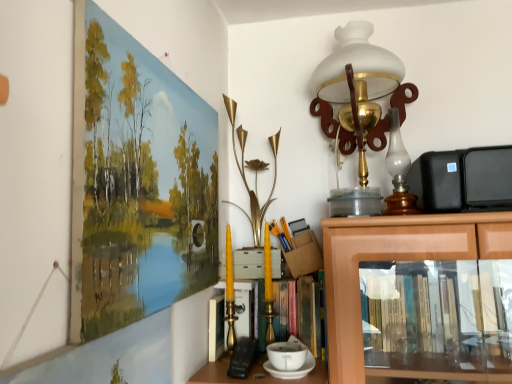
Question: Can you confirm if wooden picture frame at upper left is smaller than white frosted glass table lamp at upper right?

Choices:
 (A) no
 (B) yes

Answer: (B)

Question: Can white frosted glass table lamp at upper right be found inside wooden picture frame at upper left?

Choices:
 (A) yes
 (B) no

Answer: (B)

Question: Can you confirm if wooden picture frame at upper left is thinner than white frosted glass table lamp at upper right?

Choices:
 (A) no
 (B) yes

Answer: (B)

Question: From a real-world perspective, is wooden picture frame at upper left positioned under white frosted glass table lamp at upper right based on gravity?

Choices:
 (A) yes
 (B) no

Answer: (A)

Question: Is wooden picture frame at upper left positioned with its back to white frosted glass table lamp at upper right?

Choices:
 (A) yes
 (B) no

Answer: (B)

Question: From the image's perspective, is wooden picture frame at upper left under white frosted glass table lamp at upper right?

Choices:
 (A) no
 (B) yes

Answer: (B)

Question: Does white frosted glass table lamp at upper right have a larger size compared to wooden picture frame at upper left?

Choices:
 (A) yes
 (B) no

Answer: (A)

Question: Can you confirm if white frosted glass table lamp at upper right is shorter than wooden picture frame at upper left?

Choices:
 (A) no
 (B) yes

Answer: (A)

Question: From the image's perspective, is white frosted glass table lamp at upper right located beneath wooden picture frame at upper left?

Choices:
 (A) no
 (B) yes

Answer: (A)

Question: Is white frosted glass table lamp at upper right facing away from wooden picture frame at upper left?

Choices:
 (A) no
 (B) yes

Answer: (A)

Question: Is white frosted glass table lamp at upper right wider than wooden picture frame at upper left?

Choices:
 (A) yes
 (B) no

Answer: (A)

Question: Considering the relative sizes of white frosted glass table lamp at upper right and wooden picture frame at upper left in the image provided, is white frosted glass table lamp at upper right taller than wooden picture frame at upper left?

Choices:
 (A) yes
 (B) no

Answer: (A)

Question: From the image's perspective, relative to wooden picture frame at upper left, is white frosted glass table lamp at upper right above or below?

Choices:
 (A) above
 (B) below

Answer: (A)